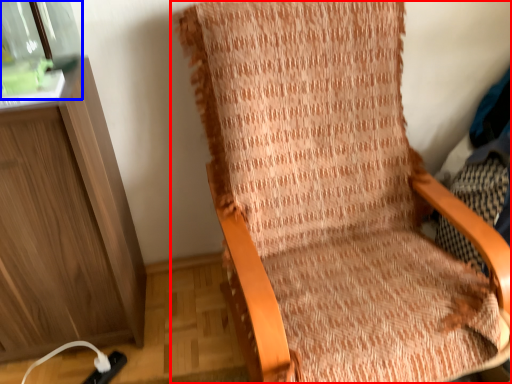
Question: Which of the following is the farthest to the observer, chair (highlighted by a red box) or glass jar (highlighted by a blue box)?

Choices:
 (A) chair
 (B) glass jar

Answer: (B)